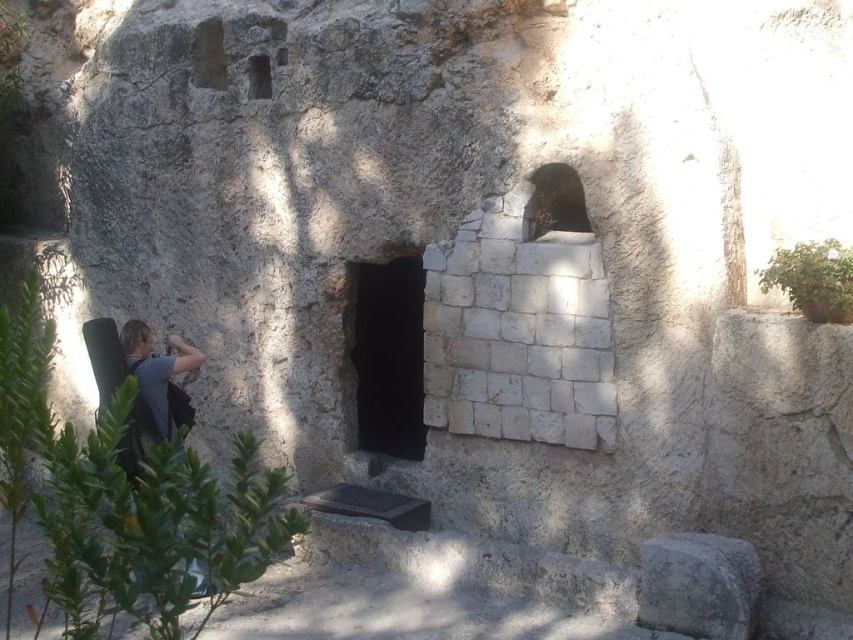
Question: Is gray rough stone at lower right thinner than gray fabric at left?

Choices:
 (A) yes
 (B) no

Answer: (B)

Question: Which point appears farthest from the camera in this image?

Choices:
 (A) (737, 602)
 (B) (166, 378)

Answer: (B)

Question: Which point appears farthest from the camera in this image?

Choices:
 (A) (695, 556)
 (B) (132, 336)

Answer: (B)

Question: Does gray rough stone at lower right have a lesser width compared to gray fabric at left?

Choices:
 (A) no
 (B) yes

Answer: (A)

Question: Is gray rough stone at lower right to the right of gray fabric at left from the viewer's perspective?

Choices:
 (A) yes
 (B) no

Answer: (A)

Question: Among these objects, which one is nearest to the camera?

Choices:
 (A) gray fabric at left
 (B) gray rough stone at lower right

Answer: (B)